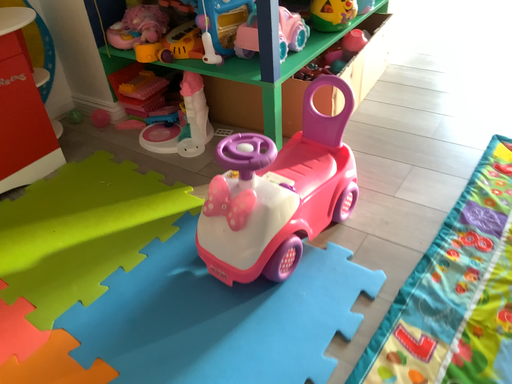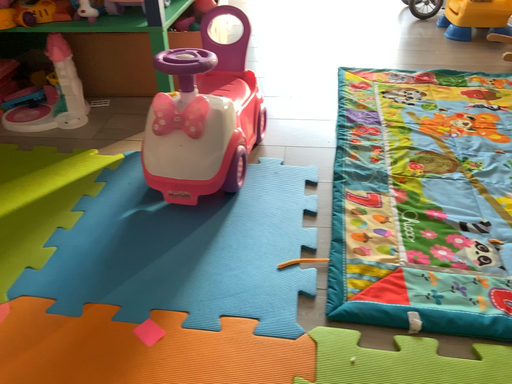
Question: How did the camera likely rotate when shooting the video?

Choices:
 (A) rotated right
 (B) rotated left

Answer: (A)